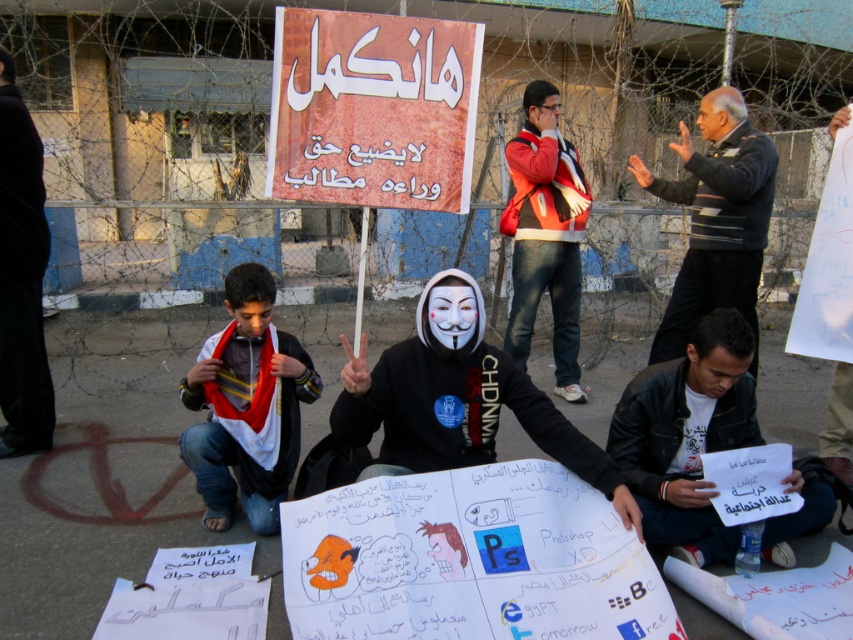
Is leather jacket at lower right shorter than striped sweater at center?

Yes, leather jacket at lower right is shorter than striped sweater at center.

Does leather jacket at lower right lie in front of striped sweater at center?

Yes, leather jacket at lower right is closer to the viewer.

Between point (717, 396) and point (723, 157), which one is positioned in front?

Point (717, 396) is more forward.

You are a GUI agent. You are given a task and a screenshot of the screen. Output one action in this format:
    pyautogui.click(x=<x>, y=<y>)
    Task: Click on the leather jacket at lower right
    This screenshot has height=640, width=853.
    Given the screenshot: What is the action you would take?
    pyautogui.click(x=688, y=436)

Can you confirm if striped sweater at center is taller than red jacket at center?

In fact, striped sweater at center may be shorter than red jacket at center.

Which is in front, point (672, 193) or point (527, 314)?

Point (672, 193)

Identify the location of striped sweater at center. (717, 220).

This screenshot has width=853, height=640. Describe the element at coordinates (717, 220) in the screenshot. I see `striped sweater at center` at that location.

Who is more forward, (x=712, y=205) or (x=0, y=148)?

Point (x=0, y=148)

Identify the location of striped sweater at center. (717, 220).